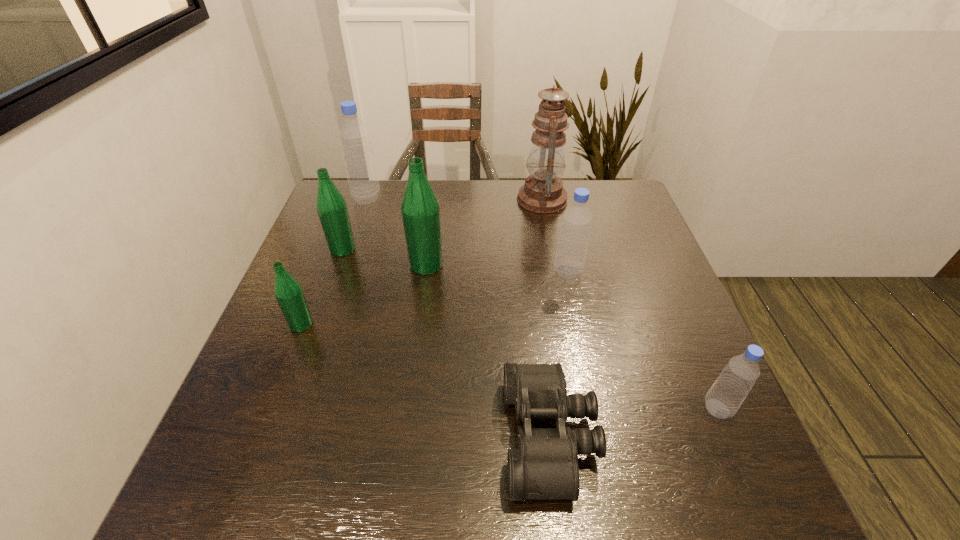
Find the location of `oil lamp`. oil lamp is located at coordinates (543, 192).

At what (x,y) coordinates should I click in order to perform the action: click on the leftmost blue bottle. Please return your answer as a coordinate pair (x, y). Image resolution: width=960 pixels, height=540 pixels. Looking at the image, I should click on (354, 136).

Find the location of a particular element. the farthest bottle is located at coordinates (354, 136).

Identify the location of the biggest green bottle. (420, 209).

In order to click on the fourth bottle from left to right in this screenshot , I will do `click(420, 209)`.

Find the location of a particular element. The width and height of the screenshot is (960, 540). the second nearest blue bottle is located at coordinates (570, 257).

At what (x,y) coordinates should I click in order to perform the action: click on the second blue bottle from left to right. Please return your answer as a coordinate pair (x, y). Looking at the image, I should click on click(x=570, y=257).

At what (x,y) coordinates should I click in order to perform the action: click on the second smallest green bottle. Please return your answer as a coordinate pair (x, y). This screenshot has width=960, height=540. Looking at the image, I should click on (331, 206).

Identify the location of the smallest green bottle. 288,292.

At what (x,y) coordinates should I click in order to perform the action: click on the second nearest bottle. Please return your answer as a coordinate pair (x, y). This screenshot has height=540, width=960. Looking at the image, I should click on (288, 292).